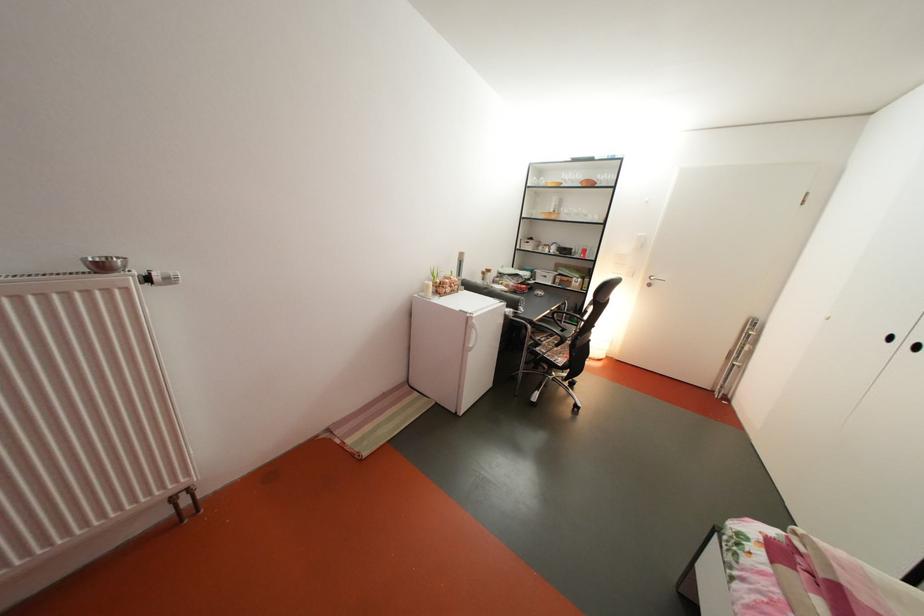
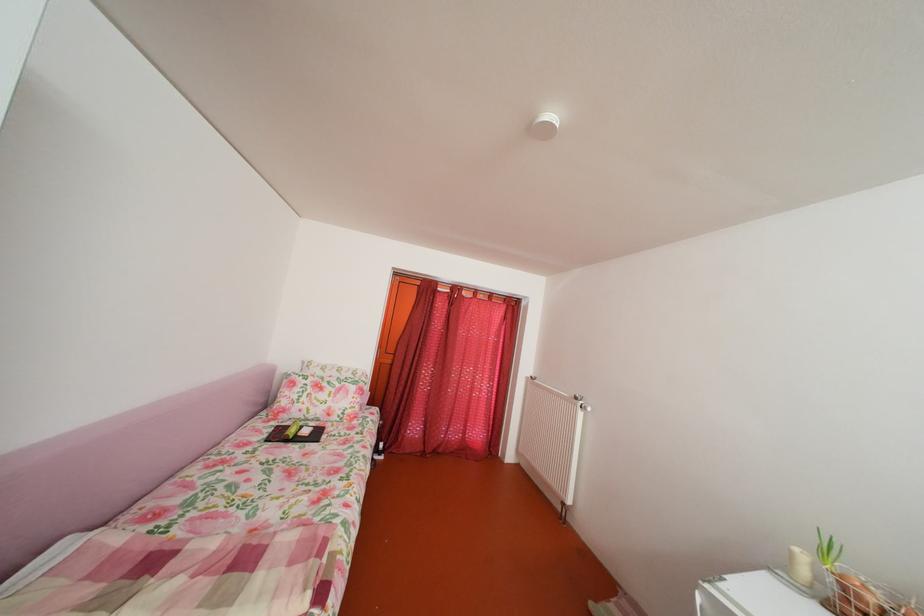
Where in the second image is the point corresponding to point (115, 274) from the first image?

(588, 405)